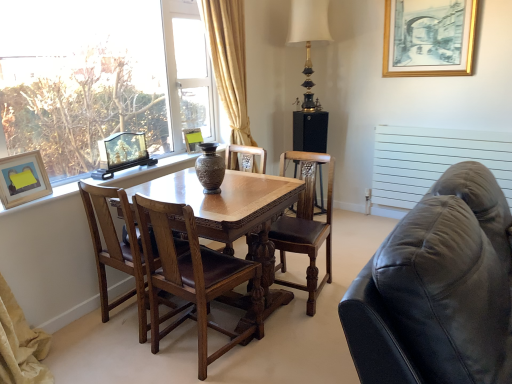
Question: In terms of size, does wooden picture frame at upper left, positioned as the first picture frame in bottom-to-top order, appear bigger or smaller than matte black picture frame at center, the 2th picture frame when ordered from right to left?

Choices:
 (A) big
 (B) small

Answer: (A)

Question: From their relative heights in the image, would you say wooden picture frame at upper left, positioned as the first picture frame in bottom-to-top order, is taller or shorter than matte black picture frame at center, the 2th picture frame when ordered from right to left?

Choices:
 (A) tall
 (B) short

Answer: (A)

Question: Estimate the real-world distances between objects in this image. Which object is farther from the brown leather chair at center, which ranks as the 3th chair in right-to-left order?

Choices:
 (A) white matte radiator at right
 (B) black leather couch at right
 (C) gold-framed print at upper right, which is counted as the fourth picture frame, starting from the left
 (D) black matte speaker at center
 (E) clear glass window at upper left

Answer: (C)

Question: Which object is the closest to the matte black picture frame at center, marked as the third picture frame in a left-to-right arrangement?

Choices:
 (A) brown leather chair at center, which appears as the first chair when viewed from the left
 (B) black leather couch at right
 (C) mahogany wood chair at center, the first chair positioned from the right
 (D) wooden picture frame at upper left, positioned as the first picture frame in bottom-to-top order
 (E) gold-bronze table lamp at upper center

Answer: (C)